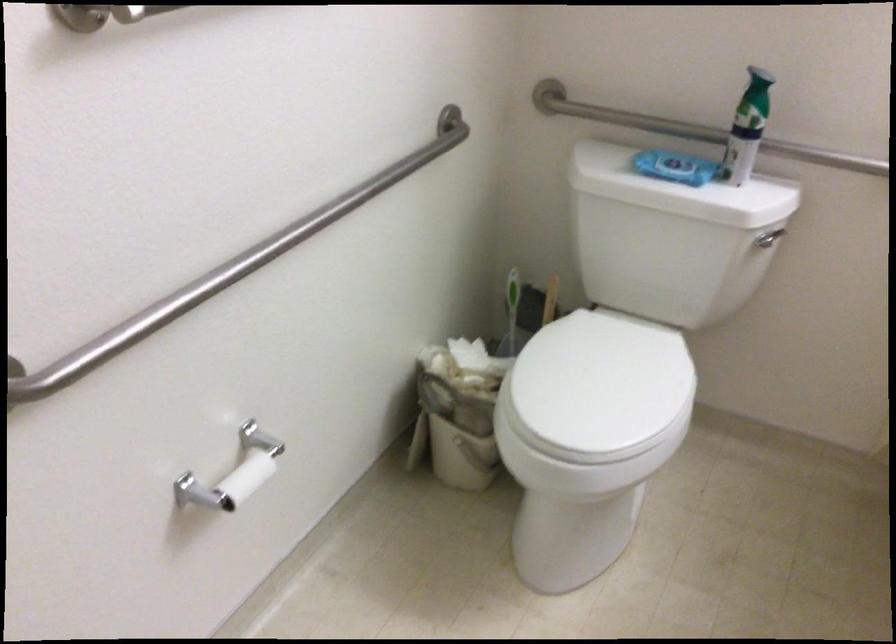
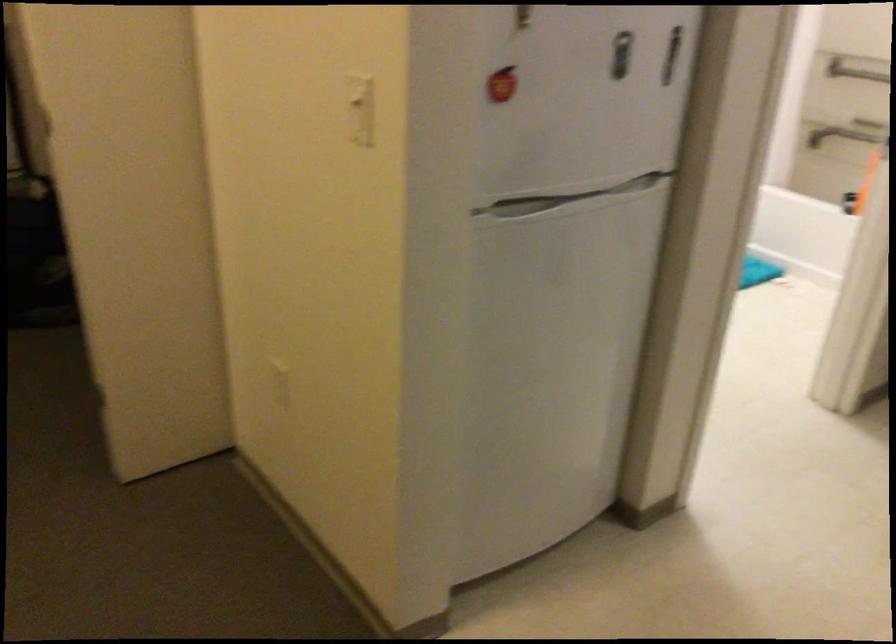
Question: I am providing you with two images of the same scene from different viewpoints. Which of the following objects are not visible in image2?

Choices:
 (A) red apple magnet
 (B) blue tablet case
 (C) blue wipes package
 (D) white light switch

Answer: (C)